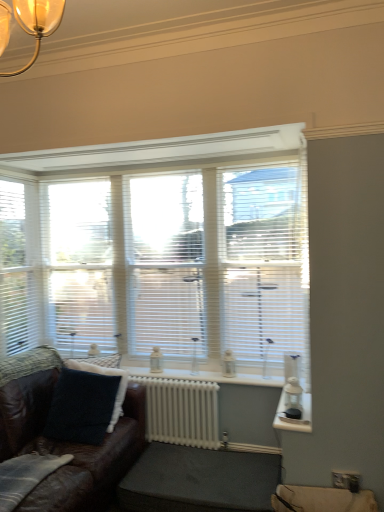
I want to click on free space above white painted metal radiator at center (from a real-world perspective), so click(x=181, y=377).